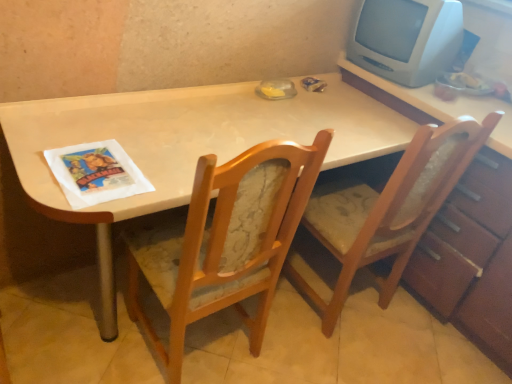
Question: From the image's perspective, does wooden dresser at right appear higher than white plastic monitor at upper right?

Choices:
 (A) yes
 (B) no

Answer: (B)

Question: Is wooden dresser at right facing towards white plastic monitor at upper right?

Choices:
 (A) no
 (B) yes

Answer: (A)

Question: From a real-world perspective, is wooden dresser at right physically above white plastic monitor at upper right?

Choices:
 (A) yes
 (B) no

Answer: (B)

Question: Is wooden dresser at right wider than white plastic monitor at upper right?

Choices:
 (A) no
 (B) yes

Answer: (B)

Question: From a real-world perspective, is wooden dresser at right under white plastic monitor at upper right?

Choices:
 (A) yes
 (B) no

Answer: (A)

Question: Is wooden dresser at right positioned in front of white plastic monitor at upper right?

Choices:
 (A) no
 (B) yes

Answer: (B)

Question: Is wooden textured chair at right, acting as the 1th chair starting from the right, beside wooden dresser at right?

Choices:
 (A) yes
 (B) no

Answer: (B)

Question: Is wooden dresser at right located within wooden textured chair at right, acting as the 1th chair starting from the right?

Choices:
 (A) yes
 (B) no

Answer: (B)

Question: Is wooden textured chair at right, acting as the 1th chair starting from the right, to the right of wooden dresser at right from the viewer's perspective?

Choices:
 (A) no
 (B) yes

Answer: (A)

Question: Is wooden textured chair at right, acting as the 1th chair starting from the right, wider than wooden dresser at right?

Choices:
 (A) yes
 (B) no

Answer: (B)

Question: Considering the relative sizes of wooden textured chair at right, acting as the 1th chair starting from the right, and wooden dresser at right in the image provided, is wooden textured chair at right, acting as the 1th chair starting from the right, shorter than wooden dresser at right?

Choices:
 (A) no
 (B) yes

Answer: (A)

Question: From a real-world perspective, is wooden textured chair at right, acting as the 1th chair starting from the right, over wooden dresser at right?

Choices:
 (A) yes
 (B) no

Answer: (A)

Question: Does white paper magazine at left have a larger size compared to wooden dresser at right?

Choices:
 (A) no
 (B) yes

Answer: (A)